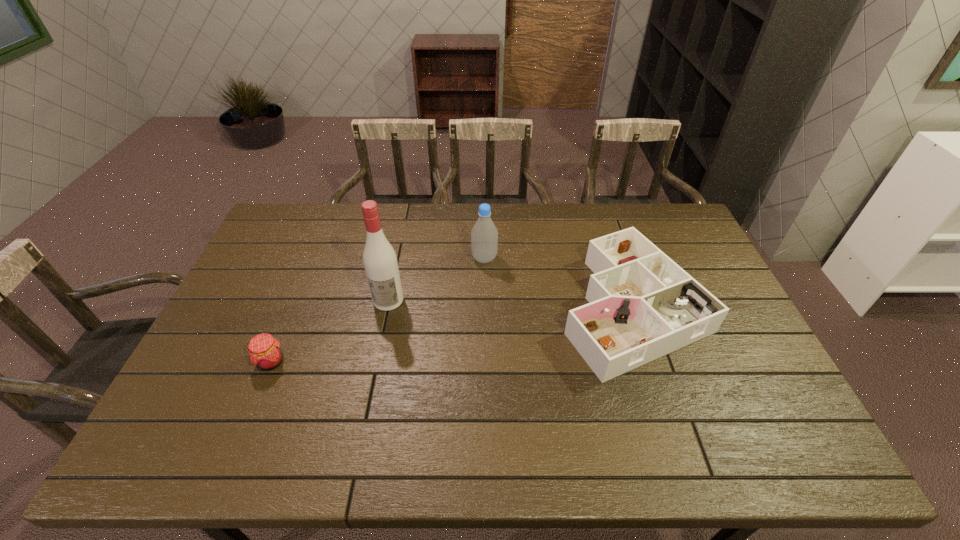
The width and height of the screenshot is (960, 540). I want to click on free space that satisfies the following two spatial constraints: 1. on the back side of the third object from left to right; 2. on the left side of the leftmost object, so click(314, 259).

You are a GUI agent. You are given a task and a screenshot of the screen. Output one action in this format:
    pyautogui.click(x=<x>, y=<y>)
    Task: Click on the free location that satisfies the following two spatial constraints: 1. on the label of the alcohol; 2. on the right side of the rightmost object
    The width and height of the screenshot is (960, 540).
    Given the screenshot: What is the action you would take?
    pyautogui.click(x=387, y=306)

In order to click on free region that satisfies the following two spatial constraints: 1. on the label of the tallest object; 2. on the left side of the rightmost object in this screenshot , I will do coord(387,306).

Where is `free space in the image that satisfies the following two spatial constraints: 1. on the front side of the second tallest object; 2. on the right side of the rightmost object`? The width and height of the screenshot is (960, 540). free space in the image that satisfies the following two spatial constraints: 1. on the front side of the second tallest object; 2. on the right side of the rightmost object is located at coordinates (485, 306).

Identify the location of vacant area that satisfies the following two spatial constraints: 1. on the label of the rightmost object; 2. on the right side of the tallest object. This screenshot has width=960, height=540. (387, 306).